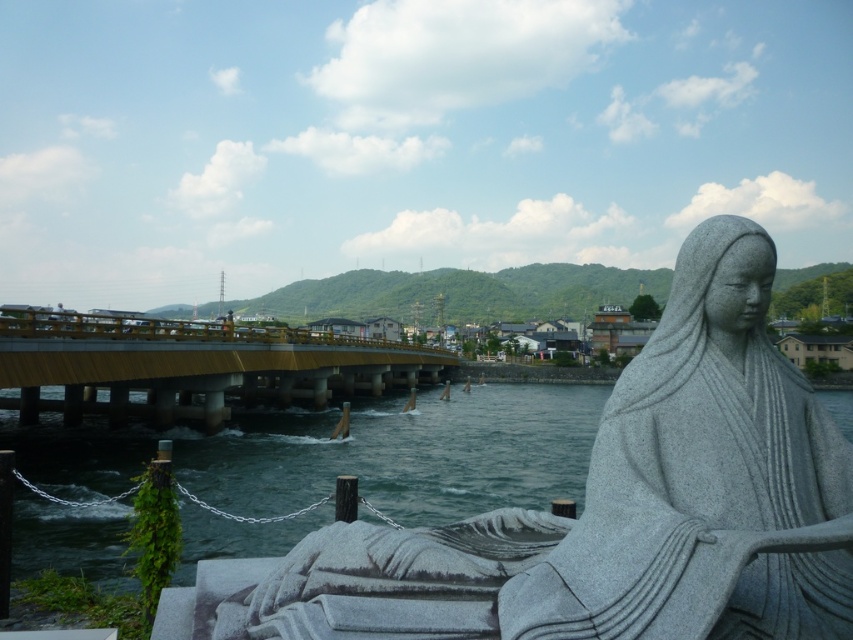
You are a tourist standing at the riverside and want to take a photo of both the granite statue at center and the yellow metallic bridge at center. Can you capture both in a single frame without moving your position?

Yes, the granite statue at center is in front of the yellow metallic bridge at center, so you can include both in your photo by positioning the statue in the foreground and the bridge in the background.

You are a tour guide leading a group near the riverside. You want to inform your group about the distance between the granite statue at center and the dark blue water at center. What do you tell them?

The granite statue at center is 21.77 meters away from the dark blue water at center.